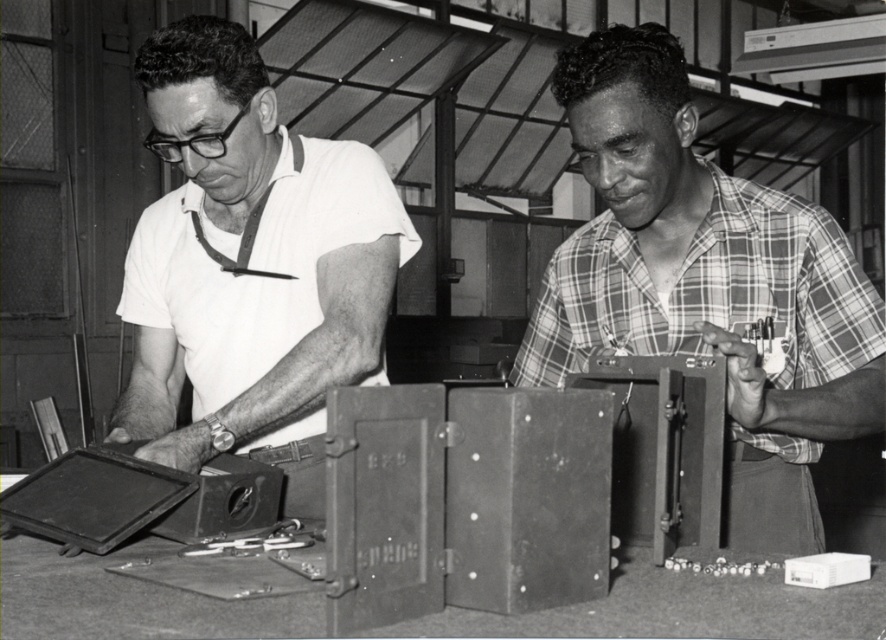
Question: Considering the relative positions of plaid shirt at center and matte white shirt at left in the image provided, where is plaid shirt at center located with respect to matte white shirt at left?

Choices:
 (A) above
 (B) below

Answer: (B)

Question: Does plaid shirt at center come in front of matte white shirt at left?

Choices:
 (A) yes
 (B) no

Answer: (A)

Question: Among these objects, which one is nearest to the camera?

Choices:
 (A) plaid shirt at center
 (B) matte white shirt at left

Answer: (A)

Question: Which of the following is the closest to the observer?

Choices:
 (A) plaid shirt at center
 (B) matte white shirt at left

Answer: (A)

Question: Does plaid shirt at center appear on the left side of matte white shirt at left?

Choices:
 (A) no
 (B) yes

Answer: (A)

Question: Which of the following is the closest to the observer?

Choices:
 (A) (628, 128)
 (B) (215, 141)

Answer: (A)